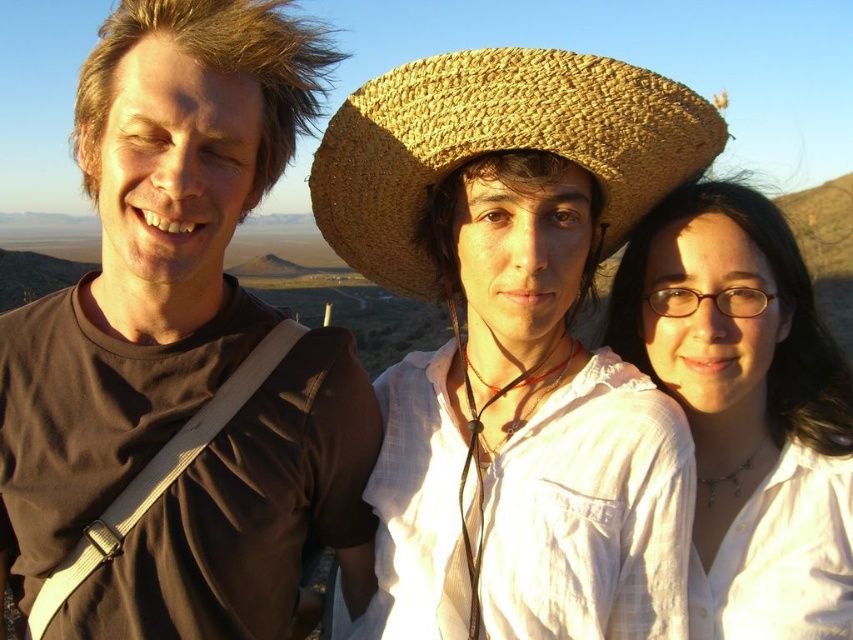
You are a photographer trying to capture a candid shot of the two people at the center. To ensure both the natural straw hat at center and the white matte shirt at center are in frame, should you adjust your camera to focus on the left side or the right side?

You should focus on the left side because the natural straw hat at center is to the left of the white matte shirt at center, so positioning the camera to the left will include both objects in the frame.

You are a photographer trying to capture a candid shot of the person wearing the white matte shirt at center and the woven straw cowboy hat at center. Since you want to ensure both subjects are in focus, which subject should you focus on first to maintain depth of field?

You should focus on the white matte shirt at center first because it is closer to you than the woven straw cowboy hat at center, so focusing on the closer subject will help keep both in focus.

You are trying to decide which item to pack for a trip. You have space for only one of the items shown in the image. Based on their sizes, which one between the natural straw hat at center and the brown matte shirt at left would you choose to take?

The natural straw hat at center is smaller than the brown matte shirt at left, so it would be the better choice to take since it takes up less space.